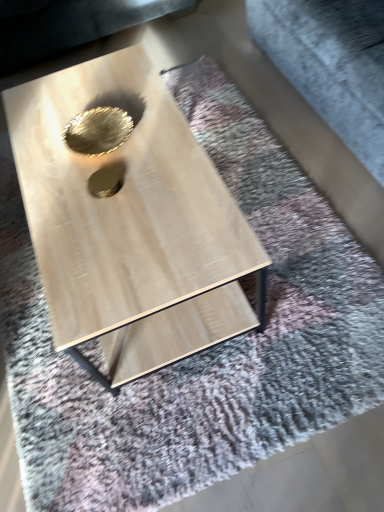
Measure the distance between gray fabric at upper right and camera.

A distance of 1.31 meters exists between gray fabric at upper right and camera.

At what (x,y) coordinates should I click in order to perform the action: click on light wood/texture coffee table at center. Please return your answer as a coordinate pair (x, y). This screenshot has width=384, height=512. Looking at the image, I should click on (130, 223).

The height and width of the screenshot is (512, 384). Find the location of `gray fabric at upper right`. gray fabric at upper right is located at coordinates (331, 64).

Where is `coffee table below the gold metallic hole at center, the 2th hole in the back-to-front sequence (from a real-world perspective)`? This screenshot has width=384, height=512. coffee table below the gold metallic hole at center, the 2th hole in the back-to-front sequence (from a real-world perspective) is located at coordinates pos(130,223).

In the image, is light wood/texture coffee table at center on the left side or the right side of gold metallic hole at center, placed as the 1th hole when sorted from bottom to top?

Based on their positions, light wood/texture coffee table at center is located to the right of gold metallic hole at center, placed as the 1th hole when sorted from bottom to top.

Considering the relative sizes of light wood/texture coffee table at center and gold metallic hole at center, placed as the 1th hole when sorted from bottom to top, in the image provided, is light wood/texture coffee table at center wider than gold metallic hole at center, placed as the 1th hole when sorted from bottom to top,?

Yes, light wood/texture coffee table at center is wider than gold metallic hole at center, placed as the 1th hole when sorted from bottom to top.

Is light wood/texture coffee table at center not within gold metallic hole at center, the 2th hole in the back-to-front sequence?

Yes, light wood/texture coffee table at center is outside of gold metallic hole at center, the 2th hole in the back-to-front sequence.

Is gold metallic hole at center, which appears as the 2th hole when ordered from the bottom, turned away from light wood/texture coffee table at center?

No, light wood/texture coffee table at center is not at the back of gold metallic hole at center, which appears as the 2th hole when ordered from the bottom.

Is gold metallic hole at center, the second hole positioned from the front, further to the viewer compared to light wood/texture coffee table at center?

Yes, gold metallic hole at center, the second hole positioned from the front, is behind light wood/texture coffee table at center.

From the image's perspective, which is above, gold metallic hole at center, which is the 1th hole from top to bottom, or light wood/texture coffee table at center?

gold metallic hole at center, which is the 1th hole from top to bottom, appears higher in the image.

Which is less distant, (86, 138) or (69, 153)?

Positioned in front is point (69, 153).

Can we say gray fabric at upper right lies outside light wood/texture coffee table at center?

Yes.

Can you see gray fabric at upper right touching light wood/texture coffee table at center?

They are not placed beside each other.

From the image's perspective, does gray fabric at upper right appear higher than light wood/texture coffee table at center?

Yes.

Considering the sizes of objects gray fabric at upper right and light wood/texture coffee table at center in the image provided, who is shorter, gray fabric at upper right or light wood/texture coffee table at center?

light wood/texture coffee table at center is shorter.

The width and height of the screenshot is (384, 512). In the image, there is a gold metallic hole at center, placed as the 1th hole when sorted from bottom to top. Identify the location of coffee table below it (from the image's perspective). (130, 223).

Is gold metallic hole at center, the 2th hole in the back-to-front sequence, closer to the viewer compared to light wood/texture coffee table at center?

That is False.

From a real-world perspective, is gold metallic hole at center, which is the second hole in top-to-bottom order, on top of light wood/texture coffee table at center?

Yes, from a real-world perspective, gold metallic hole at center, which is the second hole in top-to-bottom order, is on top of light wood/texture coffee table at center.

Is gold metallic hole at center, the 2th hole in the back-to-front sequence, facing away from gold metallic hole at center, which is the 1th hole from top to bottom?

No, gold metallic hole at center, the 2th hole in the back-to-front sequence,'s orientation is not away from gold metallic hole at center, which is the 1th hole from top to bottom.

Is gold metallic hole at center, which is the second hole in top-to-bottom order, inside the boundaries of gold metallic hole at center, which appears as the 1th hole when viewed from the back, or outside?

gold metallic hole at center, which is the second hole in top-to-bottom order, is not enclosed by gold metallic hole at center, which appears as the 1th hole when viewed from the back.

Who is taller, gold metallic hole at center, the 2th hole in the back-to-front sequence, or gold metallic hole at center, which appears as the 2th hole when ordered from the bottom?

gold metallic hole at center, which appears as the 2th hole when ordered from the bottom, is taller.

From the image's perspective, relative to gold metallic hole at center, which is the 1th hole from top to bottom, is light wood/texture coffee table at center above or below?

light wood/texture coffee table at center is below gold metallic hole at center, which is the 1th hole from top to bottom.

Is light wood/texture coffee table at center with gold metallic hole at center, the second hole positioned from the front?

There is a gap between light wood/texture coffee table at center and gold metallic hole at center, the second hole positioned from the front.

Which object is closer to the camera, light wood/texture coffee table at center or gold metallic hole at center, which appears as the 1th hole when viewed from the back?

light wood/texture coffee table at center is closer to the camera.

Does light wood/texture coffee table at center turn towards gold metallic hole at center, which appears as the 2th hole when ordered from the bottom?

No, light wood/texture coffee table at center is not turned towards gold metallic hole at center, which appears as the 2th hole when ordered from the bottom.

How many degrees apart are the facing directions of gold metallic hole at center, placed as the 1th hole when sorted from bottom to top, and gray fabric at upper right?

The facing directions of gold metallic hole at center, placed as the 1th hole when sorted from bottom to top, and gray fabric at upper right are 0.0034 degrees apart.

From the image's perspective, which object appears higher, gold metallic hole at center, the first hole positioned from the front, or gray fabric at upper right?

gray fabric at upper right, from the image's perspective.

Is gold metallic hole at center, placed as the 1th hole when sorted from bottom to top, outside of gray fabric at upper right?

Indeed, gold metallic hole at center, placed as the 1th hole when sorted from bottom to top, is completely outside gray fabric at upper right.

Which object is further away from the camera, gold metallic hole at center, placed as the 1th hole when sorted from bottom to top, or gray fabric at upper right?

gold metallic hole at center, placed as the 1th hole when sorted from bottom to top, is more distant.

This screenshot has width=384, height=512. Identify the location of coffee table on the right of gold metallic hole at center, which is the second hole in top-to-bottom order. (130, 223).

The image size is (384, 512). Find the location of `coffee table in front of the gold metallic hole at center, the second hole positioned from the front`. coffee table in front of the gold metallic hole at center, the second hole positioned from the front is located at coordinates (130, 223).

Which object lies nearer to the anchor point light wood/texture coffee table at center, gray fabric at upper right or gold metallic hole at center, which appears as the 2th hole when ordered from the bottom?

gold metallic hole at center, which appears as the 2th hole when ordered from the bottom, lies closer to light wood/texture coffee table at center than the other object.

Considering their positions, is gray fabric at upper right positioned closer to gold metallic hole at center, which appears as the 2th hole when ordered from the bottom, than light wood/texture coffee table at center?

light wood/texture coffee table at center is positioned closer to the anchor gold metallic hole at center, which appears as the 2th hole when ordered from the bottom.

Based on their spatial positions, is gold metallic hole at center, which is the second hole in top-to-bottom order, or gray fabric at upper right further from light wood/texture coffee table at center?

The object further to light wood/texture coffee table at center is gray fabric at upper right.

From the image, which object appears to be nearer to gold metallic hole at center, which is the 1th hole from top to bottom, gray fabric at upper right or gold metallic hole at center, the 2th hole in the back-to-front sequence?

gold metallic hole at center, the 2th hole in the back-to-front sequence, lies closer to gold metallic hole at center, which is the 1th hole from top to bottom, than the other object.

Based on the photo, estimate the real-world distances between objects in this image. Which object is further from gold metallic hole at center, placed as the 1th hole when sorted from bottom to top, gray fabric at upper right or gold metallic hole at center, which is the 1th hole from top to bottom?

gray fabric at upper right.

When comparing their distances from gold metallic hole at center, the second hole positioned from the front, does light wood/texture coffee table at center or gold metallic hole at center, which is the second hole in top-to-bottom order, seem closer?

Among the two, gold metallic hole at center, which is the second hole in top-to-bottom order, is located nearer to gold metallic hole at center, the second hole positioned from the front.

When comparing their distances from light wood/texture coffee table at center, does gold metallic hole at center, the first hole positioned from the front, or gold metallic hole at center, which is the 1th hole from top to bottom, seem closer?

gold metallic hole at center, which is the 1th hole from top to bottom.

Looking at the image, which one is located closer to gray fabric at upper right, gold metallic hole at center, which is the second hole in top-to-bottom order, or light wood/texture coffee table at center?

light wood/texture coffee table at center lies closer to gray fabric at upper right than the other object.

The image size is (384, 512). Find the location of `hole between gold metallic hole at center, which appears as the 2th hole when ordered from the bottom, and gray fabric at upper right`. hole between gold metallic hole at center, which appears as the 2th hole when ordered from the bottom, and gray fabric at upper right is located at coordinates (107, 180).

Where is `hole between light wood/texture coffee table at center and gold metallic hole at center, which appears as the 2th hole when ordered from the bottom, in the front-back direction`? The image size is (384, 512). hole between light wood/texture coffee table at center and gold metallic hole at center, which appears as the 2th hole when ordered from the bottom, in the front-back direction is located at coordinates (107, 180).

Locate an element on the screen. The width and height of the screenshot is (384, 512). coffee table between gold metallic hole at center, placed as the 1th hole when sorted from bottom to top, and gray fabric at upper right is located at coordinates (130, 223).

Locate an element on the screen. Image resolution: width=384 pixels, height=512 pixels. coffee table located between gold metallic hole at center, which appears as the 1th hole when viewed from the back, and gray fabric at upper right in the left-right direction is located at coordinates (130, 223).